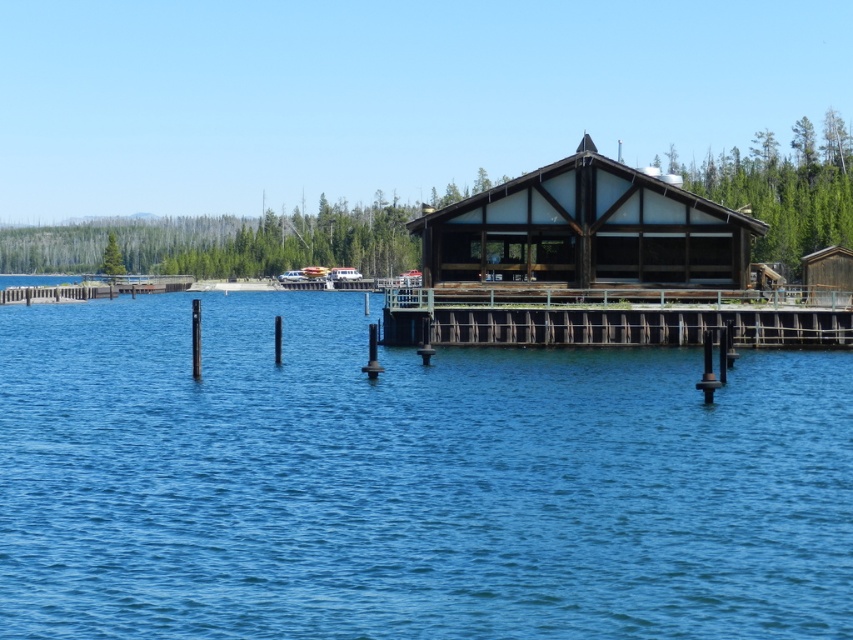
You are planning to dock your boat at the lakeside. The blue water at center and the metallic silver boat at center are both visible. Which one should you avoid hitting when maneuvering your boat into position?

You should avoid hitting the blue water at center because it has a larger size compared to the metallic silver boat at center, making it more likely to obstruct your path.

You are standing on the lakeside and see the brown wooden dock at center and the metallic silver boat at center. Which object is nearer to you?

The brown wooden dock at center is closer to the viewer than the metallic silver boat at center, so the brown wooden dock at center is nearer to you.

You are standing at the edge of the lake and want to determine which of the two points, point (299, 508) or point (296, 269), is nearer to you. Based on the scene description, which point is closer?

Point (299, 508) is closer to the viewer than point (296, 269).